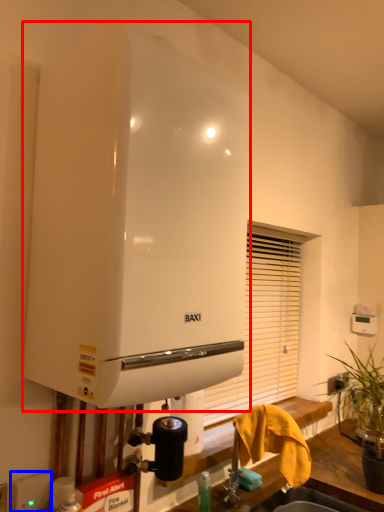
Question: Which object appears closest to the camera in this image, water heater (highlighted by a red box) or electric outlet (highlighted by a blue box)?

Choices:
 (A) water heater
 (B) electric outlet

Answer: (A)